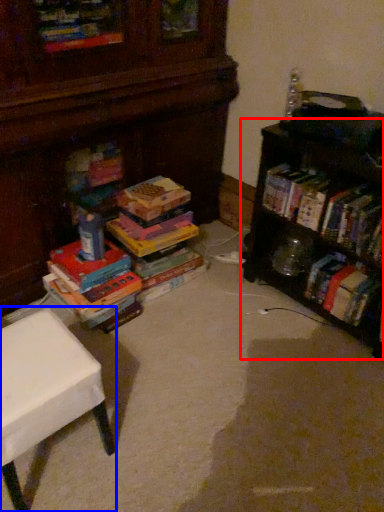
Question: Which object appears farthest to the camera in this image, shelf (highlighted by a red box) or table (highlighted by a blue box)?

Choices:
 (A) shelf
 (B) table

Answer: (A)